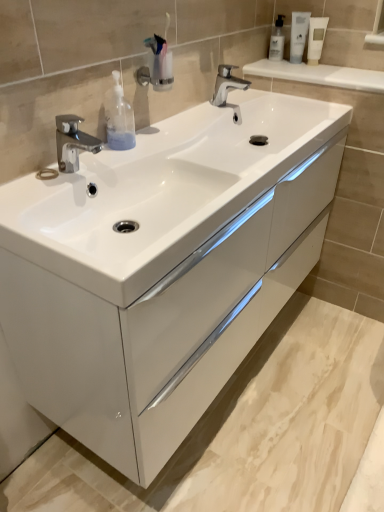
Question: In which direction should I rotate to look at polished chrome faucet at center, marked as the 2th tap in a bottom-to-top arrangement?

Choices:
 (A) right
 (B) left

Answer: (A)

Question: Can you confirm if white glossy tube at upper right, which appears as the 2th mouthwash when viewed from the left, is wider than white glossy sink at center?

Choices:
 (A) yes
 (B) no

Answer: (B)

Question: Does white glossy tube at upper right, placed as the 2th mouthwash when sorted from right to left, have a smaller size compared to white glossy sink at center?

Choices:
 (A) no
 (B) yes

Answer: (B)

Question: Is white glossy tube at upper right, which appears as the 2th mouthwash when viewed from the left, in contact with white glossy sink at center?

Choices:
 (A) yes
 (B) no

Answer: (B)

Question: Does white glossy tube at upper right, placed as the 2th mouthwash when sorted from right to left, lie behind white glossy sink at center?

Choices:
 (A) yes
 (B) no

Answer: (A)

Question: Can you confirm if white glossy tube at upper right, placed as the 2th mouthwash when sorted from right to left, is positioned to the left of white glossy sink at center?

Choices:
 (A) no
 (B) yes

Answer: (A)

Question: Is white glossy tube at upper right, which appears as the 2th mouthwash when viewed from the left, outside white glossy sink at center?

Choices:
 (A) yes
 (B) no

Answer: (A)

Question: Can you confirm if white glossy cabinet at center is positioned to the right of transparent plastic bottle at left?

Choices:
 (A) yes
 (B) no

Answer: (A)

Question: Does white glossy cabinet at center turn towards transparent plastic bottle at left?

Choices:
 (A) yes
 (B) no

Answer: (B)

Question: Does white glossy cabinet at center have a lesser height compared to transparent plastic bottle at left?

Choices:
 (A) yes
 (B) no

Answer: (B)

Question: From the image's perspective, is white glossy cabinet at center beneath transparent plastic bottle at left?

Choices:
 (A) yes
 (B) no

Answer: (A)

Question: Does white glossy cabinet at center have a larger size compared to transparent plastic bottle at left?

Choices:
 (A) yes
 (B) no

Answer: (A)

Question: Can you confirm if white glossy cabinet at center is smaller than transparent plastic bottle at left?

Choices:
 (A) no
 (B) yes

Answer: (A)

Question: From a real-world perspective, is transparent plastic bottle at left on polished chrome faucet at left, which ranks as the first tap in front-to-back order?

Choices:
 (A) yes
 (B) no

Answer: (A)